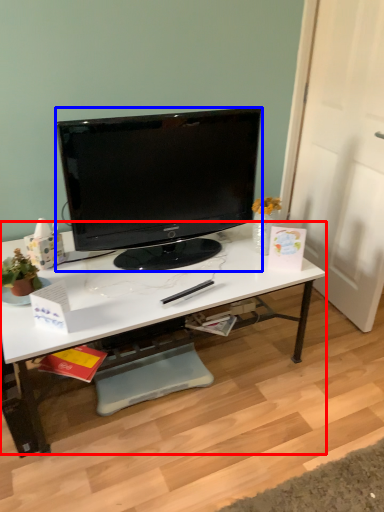
Question: Which object is closer to the camera taking this photo, desk (highlighted by a red box) or television (highlighted by a blue box)?

Choices:
 (A) desk
 (B) television

Answer: (A)